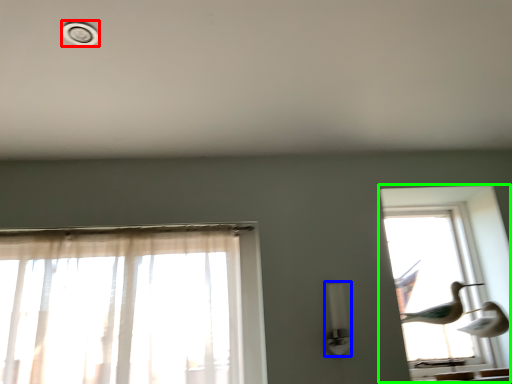
Question: Estimate the real-world distances between objects in this image. Which object is closer to dot (highlighted by a red box), light fixture (highlighted by a blue box) or window (highlighted by a green box)?

Choices:
 (A) light fixture
 (B) window

Answer: (A)